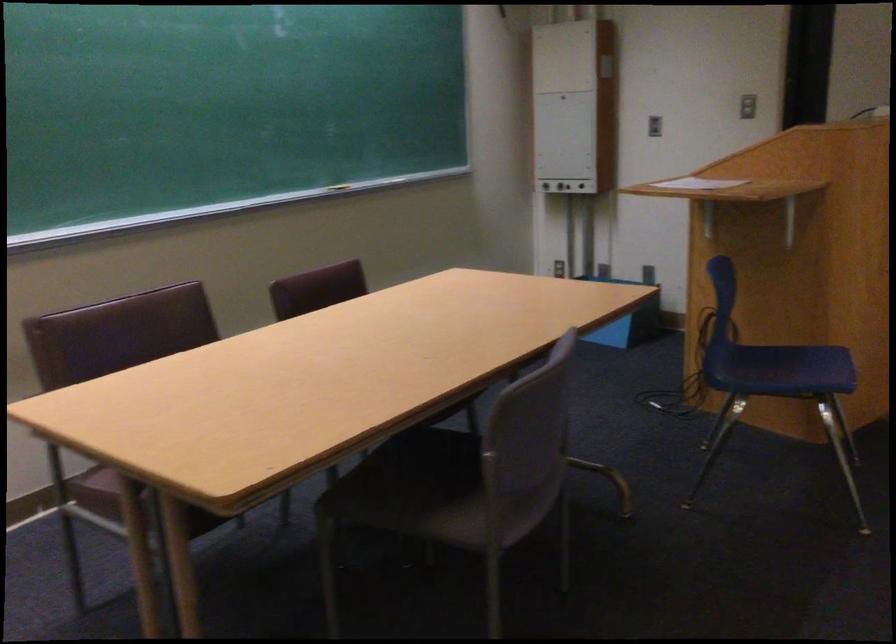
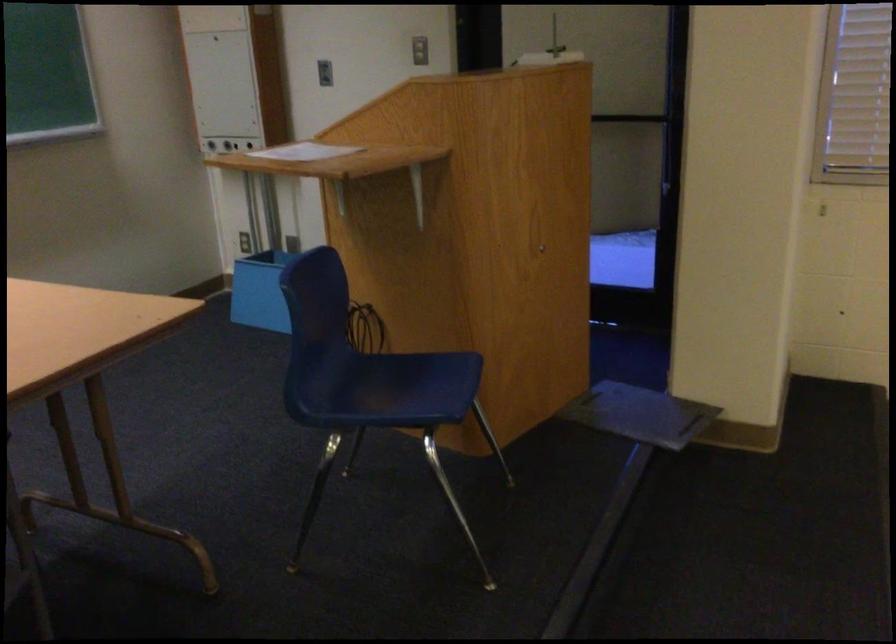
Question: The images are taken continuously from a first-person perspective. In which direction is your viewpoint rotating?

Choices:
 (A) Left
 (B) Right
 (C) Up
 (D) Down

Answer: (B)